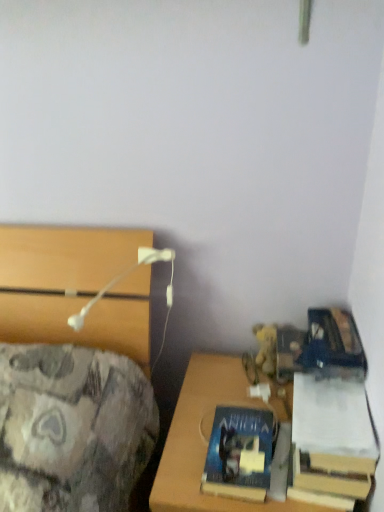
Where is `yellow plush at right`? The height and width of the screenshot is (512, 384). yellow plush at right is located at coordinates (266, 348).

The image size is (384, 512). What do you see at coordinates (332, 437) in the screenshot?
I see `hardcover book at lower right, placed as the first book when sorted from right to left` at bounding box center [332, 437].

What is the approximate width of hardcover book at lower right, placed as the first book when sorted from right to left?

hardcover book at lower right, placed as the first book when sorted from right to left, is 13.97 inches in width.

The height and width of the screenshot is (512, 384). Find the location of `wooden desk at lower right`. wooden desk at lower right is located at coordinates (208, 437).

How much space does blue matte book at lower right, which ranks as the 2th book in right-to-left order, occupy vertically?

blue matte book at lower right, which ranks as the 2th book in right-to-left order, is 6.77 centimeters tall.

I want to click on yellow plush at right, so click(266, 348).

From the image's perspective, is wooden desk at lower right located above or below yellow plush at right?

wooden desk at lower right is situated lower than yellow plush at right in the image.

Is wooden desk at lower right oriented away from yellow plush at right?

No, wooden desk at lower right is not facing away from yellow plush at right.

Is wooden desk at lower right not near yellow plush at right?

Actually, wooden desk at lower right and yellow plush at right are a little close together.

Can you tell me how much wooden desk at lower right and blue matte book at lower right, the 1th book when ordered from left to right, differ in facing direction?

The facing directions of wooden desk at lower right and blue matte book at lower right, the 1th book when ordered from left to right, are 0.149 degrees apart.

Relative to blue matte book at lower right, the 1th book when ordered from left to right, is wooden desk at lower right in front or behind?

Visually, wooden desk at lower right is located in front of blue matte book at lower right, the 1th book when ordered from left to right.

At what (x,y) coordinates should I click in order to perform the action: click on the 2nd book behind the wooden desk at lower right. Please return your answer as a coordinate pair (x, y). Looking at the image, I should click on (239, 454).

From a real-world perspective, is wooden desk at lower right located beneath blue matte book at lower right, which ranks as the 2th book in right-to-left order?

Correct, in the physical world, wooden desk at lower right is lower than blue matte book at lower right, which ranks as the 2th book in right-to-left order.

Is hardcover book at lower right, placed as the first book when sorted from right to left, wider or thinner than yellow plush at right?

hardcover book at lower right, placed as the first book when sorted from right to left, is wider than yellow plush at right.

Is hardcover book at lower right, placed as the first book when sorted from right to left, turned away from yellow plush at right?

hardcover book at lower right, placed as the first book when sorted from right to left, is not turned away from yellow plush at right.

Is point (333, 422) behind point (272, 347)?

No, (333, 422) is in front of (272, 347).

From the image's perspective, which one is positioned lower, hardcover book at lower right, placed as the first book when sorted from right to left, or yellow plush at right?

From the image's view, hardcover book at lower right, placed as the first book when sorted from right to left, is below.

Visually, is hardcover book at lower right, placed as the first book when sorted from right to left, positioned to the left or to the right of wooden desk at lower right?

Clearly, hardcover book at lower right, placed as the first book when sorted from right to left, is on the right of wooden desk at lower right in the image.

Could you tell me if hardcover book at lower right, placed as the first book when sorted from right to left, is turned towards wooden desk at lower right?

No, hardcover book at lower right, placed as the first book when sorted from right to left, is not turned towards wooden desk at lower right.

This screenshot has width=384, height=512. Identify the location of desk on the left side of hardcover book at lower right, placed as the first book when sorted from right to left. (208, 437).

From the image's perspective, between hardcover book at lower right, which is the 2th book from left to right, and wooden desk at lower right, who is located below?

wooden desk at lower right, from the image's perspective.

From a real-world perspective, who is located higher, white plastic table lamp at upper left or blue matte book at lower right, the 1th book when ordered from left to right?

white plastic table lamp at upper left, from a real-world perspective.

Considering the sizes of objects white plastic table lamp at upper left and blue matte book at lower right, which ranks as the 2th book in right-to-left order, in the image provided, who is taller, white plastic table lamp at upper left or blue matte book at lower right, which ranks as the 2th book in right-to-left order,?

Standing taller between the two is white plastic table lamp at upper left.

Is white plastic table lamp at upper left bigger or smaller than blue matte book at lower right, the 1th book when ordered from left to right?

In the image, white plastic table lamp at upper left appears to be larger than blue matte book at lower right, the 1th book when ordered from left to right.

Are white plastic table lamp at upper left and blue matte book at lower right, the 1th book when ordered from left to right, beside each other?

No.

Identify the location of book located underneath the hardcover book at lower right, placed as the first book when sorted from right to left (from a real-world perspective). (239, 454).

How different are the orientations of blue matte book at lower right, which ranks as the 2th book in right-to-left order, and hardcover book at lower right, which is the 2th book from left to right, in degrees?

They differ by 0.586 degrees in their facing directions.

Considering the sizes of objects blue matte book at lower right, which ranks as the 2th book in right-to-left order, and hardcover book at lower right, placed as the first book when sorted from right to left, in the image provided, who is wider, blue matte book at lower right, which ranks as the 2th book in right-to-left order, or hardcover book at lower right, placed as the first book when sorted from right to left,?

Wider between the two is hardcover book at lower right, placed as the first book when sorted from right to left.

Considering the positions of objects blue matte book at lower right, which ranks as the 2th book in right-to-left order, and hardcover book at lower right, which is the 2th book from left to right, in the image provided, who is more to the left, blue matte book at lower right, which ranks as the 2th book in right-to-left order, or hardcover book at lower right, which is the 2th book from left to right,?

blue matte book at lower right, which ranks as the 2th book in right-to-left order, is more to the left.

From the image's perspective, is blue matte book at lower right, the 1th book when ordered from left to right, above or below yellow plush at right?

From the image's perspective, blue matte book at lower right, the 1th book when ordered from left to right, appears below yellow plush at right.

In terms of size, does blue matte book at lower right, the 1th book when ordered from left to right, appear bigger or smaller than yellow plush at right?

Considering their sizes, blue matte book at lower right, the 1th book when ordered from left to right, takes up more space than yellow plush at right.

I want to click on book that is the 1st object located in front of the yellow plush at right, so (x=239, y=454).

Which is behind, point (261, 459) or point (272, 335)?

The point (272, 335) is farther from the camera.

Locate an element on the screen. toy above the wooden desk at lower right (from a real-world perspective) is located at coordinates (266, 348).

The image size is (384, 512). Identify the location of book that is the 1st one when counting upward from the wooden desk at lower right (from the image's perspective). (239, 454).

When comparing their distances from hardcover book at lower right, placed as the first book when sorted from right to left, does yellow plush at right or blue matte book at lower right, which ranks as the 2th book in right-to-left order, seem closer?

blue matte book at lower right, which ranks as the 2th book in right-to-left order.

Considering their positions, is white plastic table lamp at upper left positioned further to hardcover book at lower right, placed as the first book when sorted from right to left, than blue matte book at lower right, the 1th book when ordered from left to right?

white plastic table lamp at upper left.

Which object lies nearer to the anchor point white plastic table lamp at upper left, hardcover book at lower right, placed as the first book when sorted from right to left, or yellow plush at right?

yellow plush at right.

When comparing their distances from yellow plush at right, does hardcover book at lower right, which is the 2th book from left to right, or blue matte book at lower right, the 1th book when ordered from left to right, seem closer?

Based on the image, blue matte book at lower right, the 1th book when ordered from left to right, appears to be nearer to yellow plush at right.

When comparing their distances from hardcover book at lower right, placed as the first book when sorted from right to left, does white plastic table lamp at upper left or wooden desk at lower right seem closer?

The object closer to hardcover book at lower right, placed as the first book when sorted from right to left, is wooden desk at lower right.

Which object lies further to the anchor point wooden desk at lower right, blue matte book at lower right, the 1th book when ordered from left to right, or hardcover book at lower right, which is the 2th book from left to right?

The object further to wooden desk at lower right is hardcover book at lower right, which is the 2th book from left to right.

Which object lies nearer to the anchor point blue matte book at lower right, which ranks as the 2th book in right-to-left order, yellow plush at right or hardcover book at lower right, placed as the first book when sorted from right to left?

Based on the image, hardcover book at lower right, placed as the first book when sorted from right to left, appears to be nearer to blue matte book at lower right, which ranks as the 2th book in right-to-left order.

Looking at the image, which one is located further to wooden desk at lower right, blue matte book at lower right, the 1th book when ordered from left to right, or yellow plush at right?

Among the two, yellow plush at right is located further to wooden desk at lower right.

Where is `book between white plastic table lamp at upper left and yellow plush at right in the front-back direction`? The width and height of the screenshot is (384, 512). book between white plastic table lamp at upper left and yellow plush at right in the front-back direction is located at coordinates (239, 454).

The image size is (384, 512). Find the location of `book positioned between hardcover book at lower right, which is the 2th book from left to right, and yellow plush at right from near to far`. book positioned between hardcover book at lower right, which is the 2th book from left to right, and yellow plush at right from near to far is located at coordinates (239, 454).

Where is `toy between white plastic table lamp at upper left and hardcover book at lower right, which is the 2th book from left to right, in the horizontal direction`? The image size is (384, 512). toy between white plastic table lamp at upper left and hardcover book at lower right, which is the 2th book from left to right, in the horizontal direction is located at coordinates (266, 348).

At what (x,y) coordinates should I click in order to perform the action: click on book between hardcover book at lower right, placed as the first book when sorted from right to left, and wooden desk at lower right vertically. Please return your answer as a coordinate pair (x, y). This screenshot has width=384, height=512. Looking at the image, I should click on (239, 454).